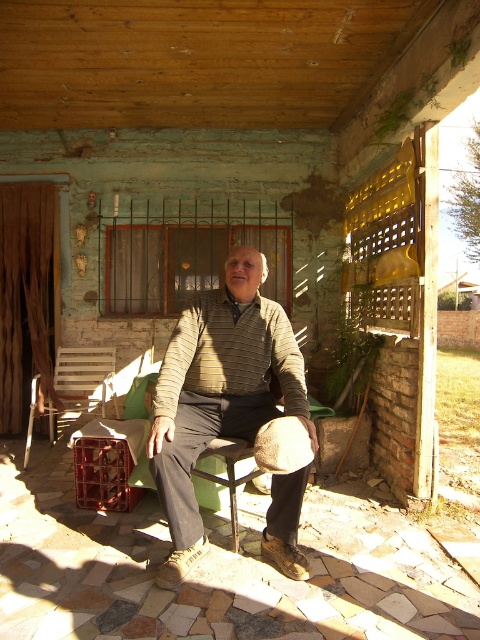
You are a tailor who needs to determine if the striped knit sweater at center can be folded and placed on the wooden slats chair at left without exceeding its height. Based on the scene description, can the sweater be placed there?

The striped knit sweater at center is taller than wooden slats chair at left, so it cannot be placed on the chair without exceeding its height.

You are a delivery person trying to place a package between the striped knit sweater at center and the wooden slats chair at left. The package is 8 feet long. Can you fit it between them?

The distance between the striped knit sweater at center and the wooden slats chair at left is 7.57 feet. Since the package is 8 feet long, it is slightly longer than the available space, so it won measurements. The package cannot be placed between them without overlapping the objects.

What is the location of the point at coordinates (218, 392) in the scene?

The point at coordinates (218, 392) is located on the striped knit sweater at center.